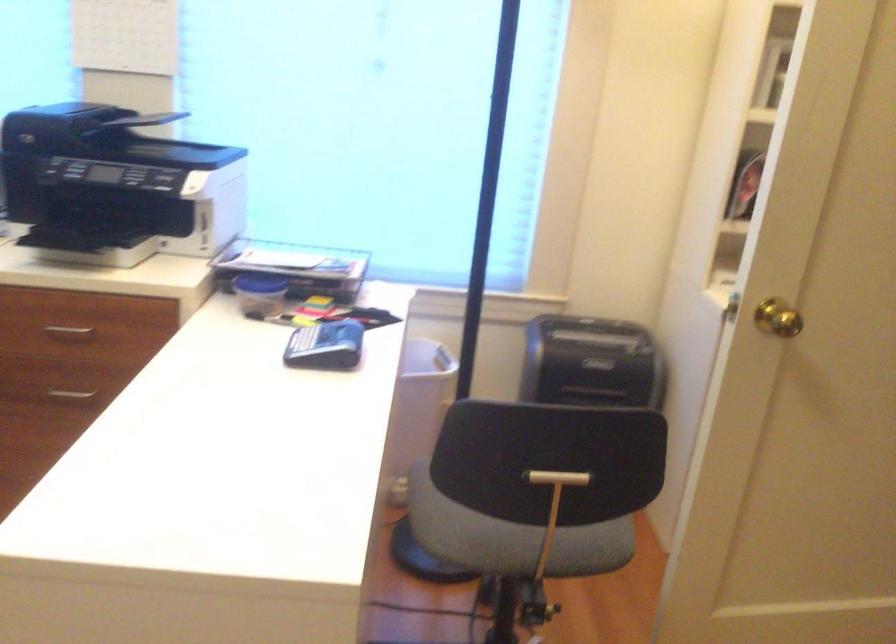
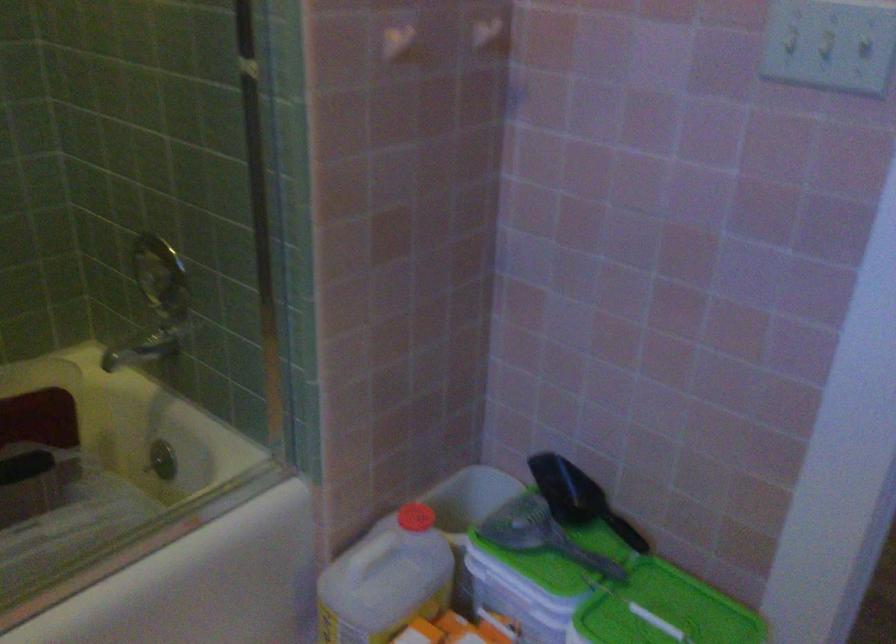
Question: I am providing you with two images of the same scene from different viewpoints. Please identify which objects are invisible in image2.

Choices:
 (A) white wall hook
 (B) white plastic jug
 (C) gold door handle
 (D) grey shoe

Answer: (C)